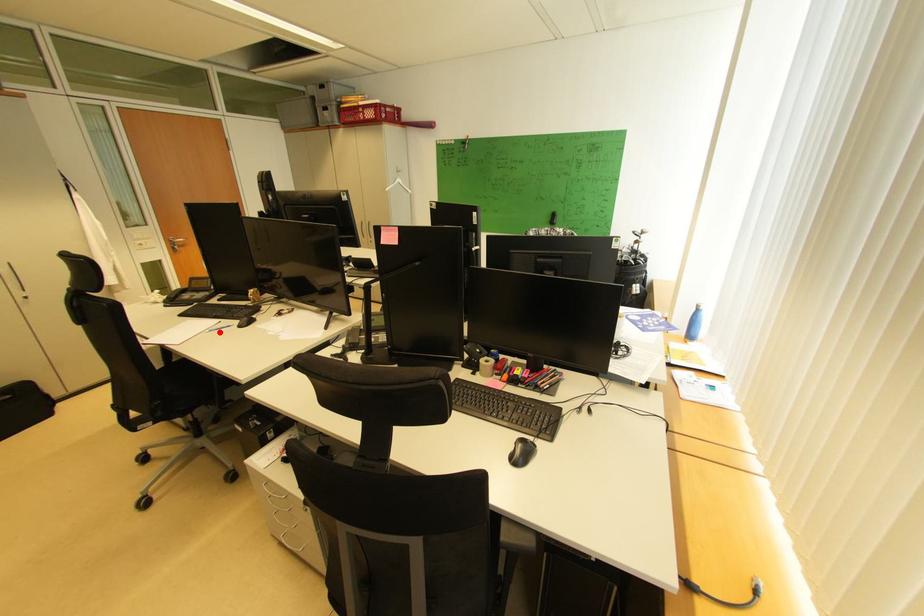
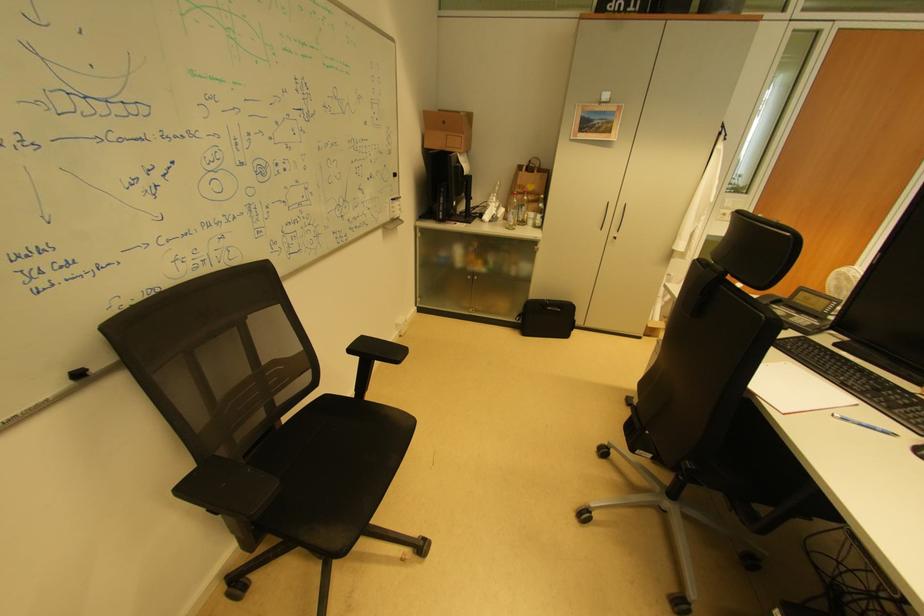
In the second image, find the point that corresponds to the highlighted location in the first image.

(853, 421)